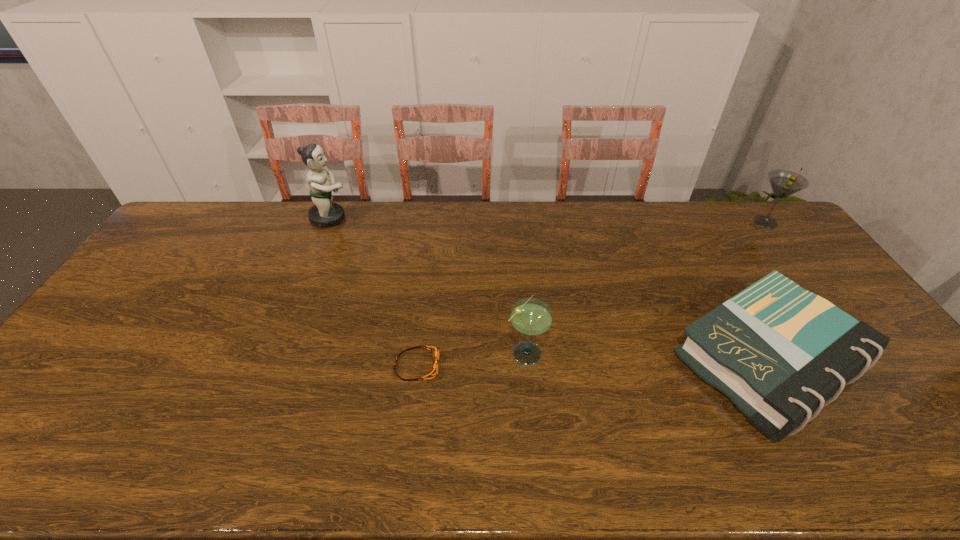
Find the location of `blank space located 0.390m on the left of the farther martini`. blank space located 0.390m on the left of the farther martini is located at coordinates (641, 222).

This screenshot has width=960, height=540. What are the coordinates of `free space located on the front of the left martini` in the screenshot? It's located at (536, 457).

I want to click on vacant space located 0.240m on the left of the paperback book, so click(x=585, y=361).

Where is `vacant space located with the lenses facing forward on the shortest object`? The width and height of the screenshot is (960, 540). vacant space located with the lenses facing forward on the shortest object is located at coordinates (469, 366).

Where is `figurine at the far edge`? figurine at the far edge is located at coordinates (325, 213).

Identify the location of martini positioned at the far edge. This screenshot has height=540, width=960. tap(784, 183).

I want to click on object that is at the near edge, so click(781, 353).

The height and width of the screenshot is (540, 960). I want to click on martini that is at the right edge, so click(784, 183).

This screenshot has width=960, height=540. In order to click on paperback book that is at the right edge in this screenshot , I will do `click(781, 353)`.

At what (x,y) coordinates should I click in order to perform the action: click on object located in the far right corner section of the desktop. Please return your answer as a coordinate pair (x, y). Image resolution: width=960 pixels, height=540 pixels. Looking at the image, I should click on (784, 183).